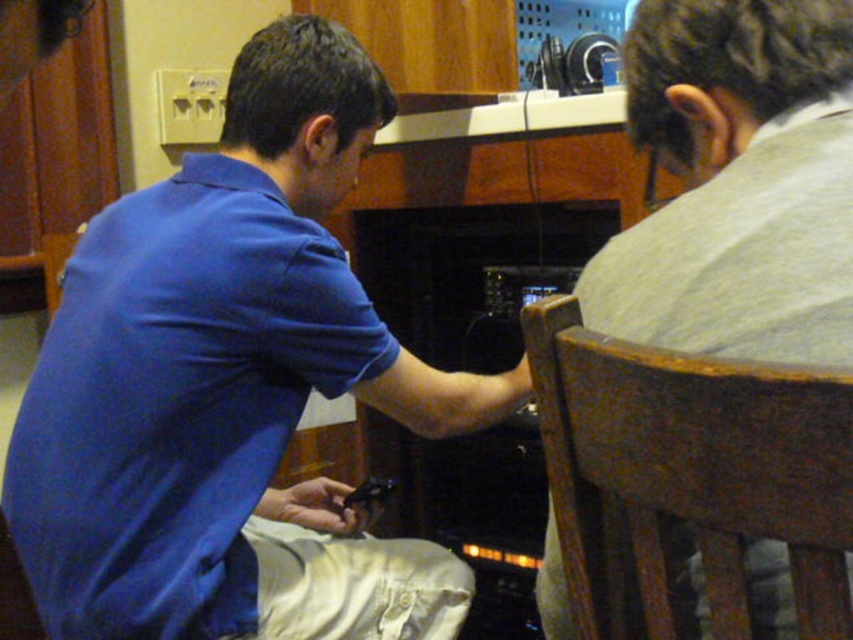
Which is more to the right, blue cotton shirt at center or brown wood chair at right?

brown wood chair at right

Between point (67, 580) and point (732, 577), which one is positioned behind?

Point (67, 580)

Where is `blue cotton shirt at center`? blue cotton shirt at center is located at coordinates (231, 387).